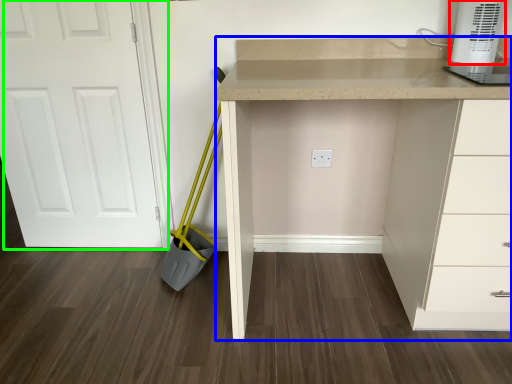
Question: Based on their relative distances, which object is farther from home appliance (highlighted by a red box)? Choose from computer desk (highlighted by a blue box) and door (highlighted by a green box).

Choices:
 (A) computer desk
 (B) door

Answer: (B)